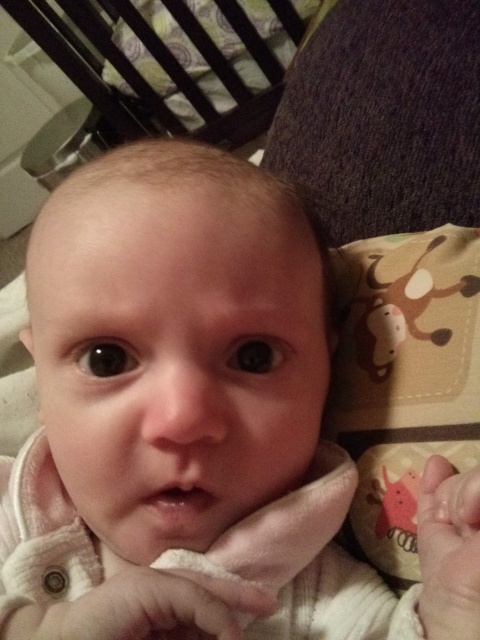
Based on the scene description, where is the dark wood crib at upper left located in terms of coordinates?

The dark wood crib at upper left is located at coordinates (213,67).

You are a photographer setting up for a baby photoshoot. You have a camera with a focal length of 50mm and want to capture the soft beige fabric hand at center in focus while keeping the background slightly blurred. Considering the distance between the camera and the subject, what adjustment should you make to the aperture setting?

To achieve a blurred background while focusing on the soft beige fabric hand at center, you should use a wider aperture setting, such as f1.8 or lower, which allows more light in and creates a shallower depth of field. Since the subject is 10.47 inches from the camera, a wider aperture will help isolate the soft beige fabric hand at center from the background.

You are standing 5 feet away from the point at coordinates point (260, 35). Can you reach it without moving closer?

The distance of point (260, 35) from viewer is 6.07 feet, so you are currently 5 feet away from it. Since 5 feet is less than 6.07 feet, you are actually closer than the stated distance. Therefore, you can reach it without needing to move closer.